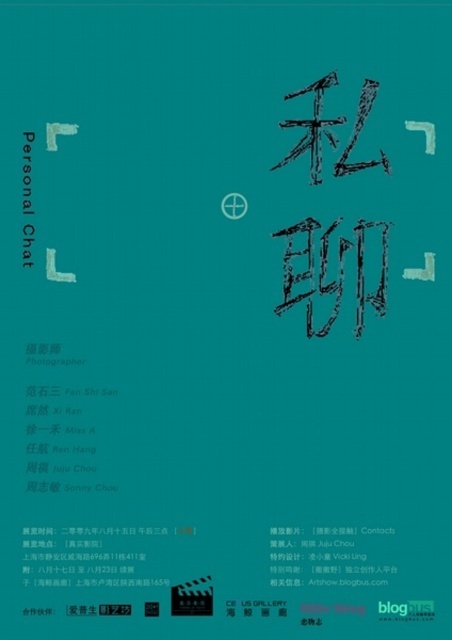
Question: Which point is farther to the camera?

Choices:
 (A) (301, 540)
 (B) (27, 148)

Answer: (A)

Question: Among these objects, which one is farthest from the camera?

Choices:
 (A) black paper at center
 (B) white paper at center

Answer: (A)

Question: Can you confirm if black paper at center is positioned below white paper at center?

Choices:
 (A) no
 (B) yes

Answer: (B)

Question: Can you confirm if black paper at center is positioned above white paper at center?

Choices:
 (A) no
 (B) yes

Answer: (A)

Question: Does black paper at center come behind white paper at center?

Choices:
 (A) yes
 (B) no

Answer: (A)